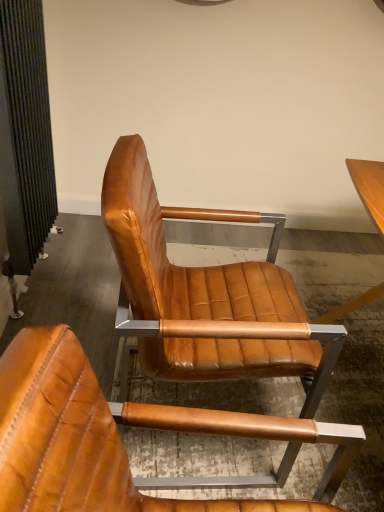
Question: Is cognac leather chair at center, placed as the 2th chair when sorted from back to front, taller or shorter than cognac leather chair at center, the second chair viewed from the front?

Choices:
 (A) tall
 (B) short

Answer: (B)

Question: Which is correct: cognac leather chair at center, marked as the first chair in a front-to-back arrangement, is inside cognac leather chair at center, which is the 1th chair in back-to-front order, or outside of it?

Choices:
 (A) inside
 (B) outside

Answer: (B)

Question: Considering the relative positions of cognac leather chair at center, marked as the first chair in a front-to-back arrangement, and cognac leather chair at center, the second chair viewed from the front, in the image provided, is cognac leather chair at center, marked as the first chair in a front-to-back arrangement, to the left or to the right of cognac leather chair at center, the second chair viewed from the front,?

Choices:
 (A) left
 (B) right

Answer: (A)

Question: From the image's perspective, is cognac leather chair at center, which is the 1th chair in back-to-front order, positioned above or below cognac leather chair at center, marked as the first chair in a front-to-back arrangement?

Choices:
 (A) below
 (B) above

Answer: (B)

Question: Is point (178, 329) positioned closer to the camera than point (64, 448)?

Choices:
 (A) closer
 (B) farther

Answer: (B)

Question: From their relative heights in the image, would you say cognac leather chair at center, the second chair viewed from the front, is taller or shorter than cognac leather chair at center, marked as the first chair in a front-to-back arrangement?

Choices:
 (A) short
 (B) tall

Answer: (B)

Question: In terms of width, does cognac leather chair at center, which is the 1th chair in back-to-front order, look wider or thinner when compared to cognac leather chair at center, placed as the 2th chair when sorted from back to front?

Choices:
 (A) wide
 (B) thin

Answer: (A)